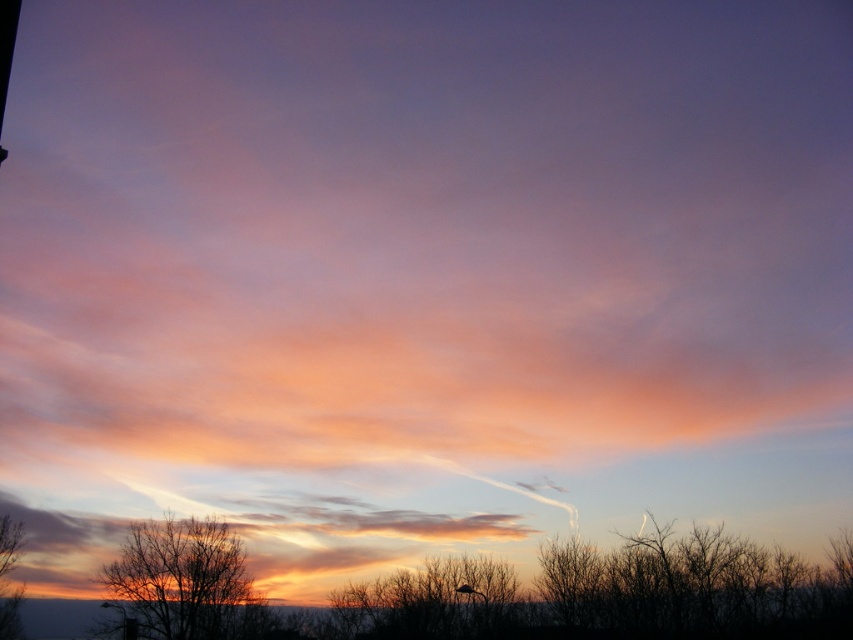
Question: Which of these objects is positioned farthest from the translucent white cloud at center?

Choices:
 (A) brown matte tree at lower left
 (B) silhouette bare tree at lower left

Answer: (B)

Question: Does silhouette bare tree at lower left appear on the right side of brown matte tree at lower left?

Choices:
 (A) no
 (B) yes

Answer: (B)

Question: Is translucent white cloud at center smaller than brown matte tree at lower left?

Choices:
 (A) no
 (B) yes

Answer: (A)

Question: Which point appears farthest from the camera in this image?

Choices:
 (A) (190, 531)
 (B) (297, 557)

Answer: (B)

Question: Does silhouette bare tree at lower left have a smaller size compared to brown matte tree at lower left?

Choices:
 (A) yes
 (B) no

Answer: (A)

Question: Which of the following is the closest to the observer?

Choices:
 (A) silhouette bare tree at lower left
 (B) brown matte tree at lower left

Answer: (A)